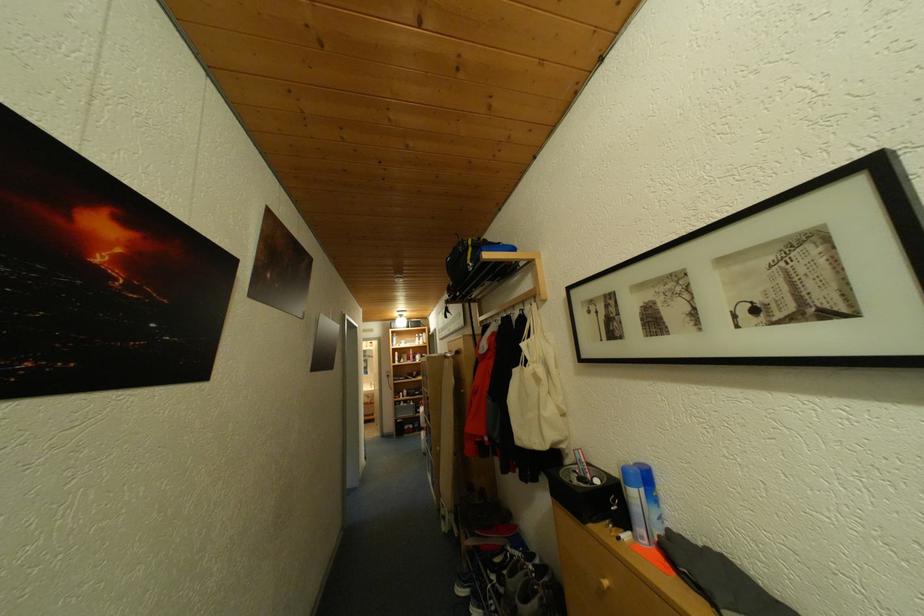
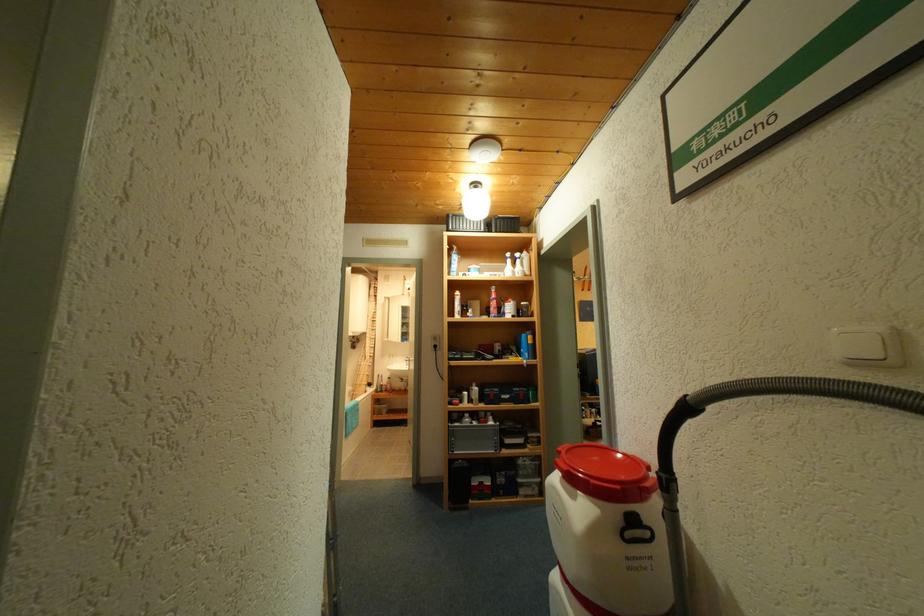
Question: In a continuous first-person perspective shot, in which direction is the camera moving?

Choices:
 (A) Left
 (B) Right
 (C) Forward
 (D) Backward

Answer: (C)